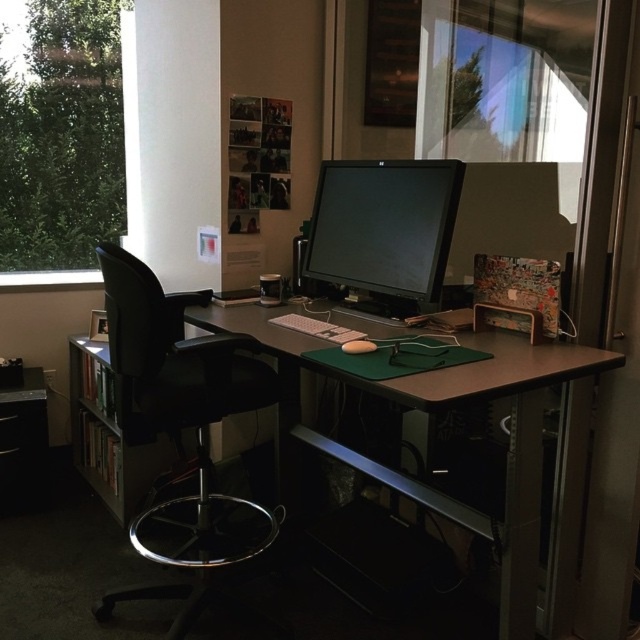
Which is more to the left, transparent glass window at upper left or brown wood computer desk at center?

Positioned to the left is transparent glass window at upper left.

Is transparent glass window at upper left further to camera compared to brown wood computer desk at center?

Yes, transparent glass window at upper left is behind brown wood computer desk at center.

Is point (44, 93) positioned after point (477, 369)?

Yes, it is.

Locate an element on the screen. This screenshot has width=640, height=640. transparent glass window at upper left is located at coordinates (61, 138).

Who is more distant from viewer, (531, 228) or (538, 518)?

Point (531, 228)

Who is more forward, (625, 376) or (237, 330)?

Point (625, 376) is in front.

At what (x,y) coordinates should I click in order to perform the action: click on transparent glass door at upper center. Please return your answer as a coordinate pair (x, y). Looking at the image, I should click on (554, 186).

Where is `transparent glass door at upper center`? The height and width of the screenshot is (640, 640). transparent glass door at upper center is located at coordinates (554, 186).

Which of these two, transparent glass door at upper center or black leather swivel chair at left, stands shorter?

black leather swivel chair at left

Who is positioned more to the left, transparent glass door at upper center or black leather swivel chair at left?

Positioned to the left is black leather swivel chair at left.

The height and width of the screenshot is (640, 640). What do you see at coordinates (554, 186) in the screenshot?
I see `transparent glass door at upper center` at bounding box center [554, 186].

Where is `transparent glass door at upper center`? This screenshot has width=640, height=640. transparent glass door at upper center is located at coordinates (554, 186).